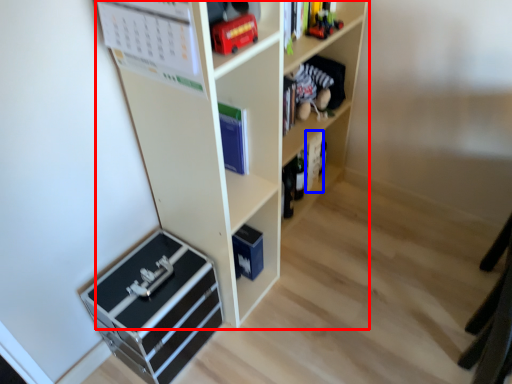
Question: Which point is closer to the camera, shelf (highlighted by a red box) or book (highlighted by a blue box)?

Choices:
 (A) shelf
 (B) book

Answer: (A)